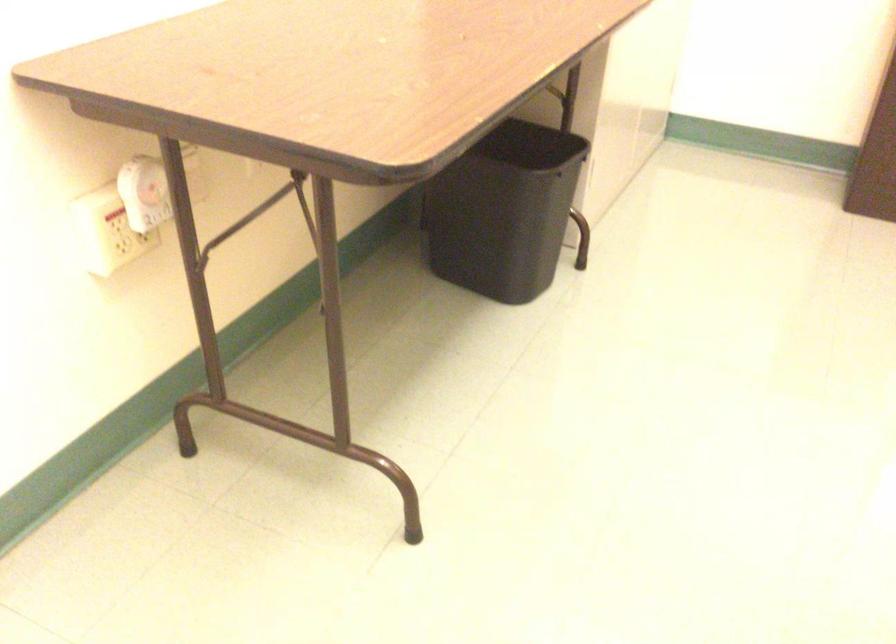
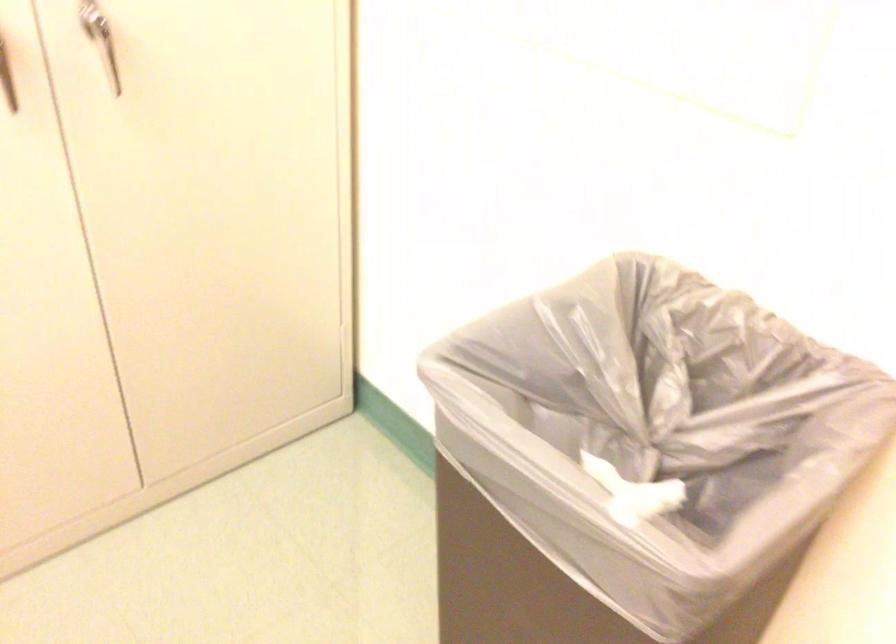
Based on the photo, what movement of the cameraman would produce the second image?

The cameraman walked toward right, forward.